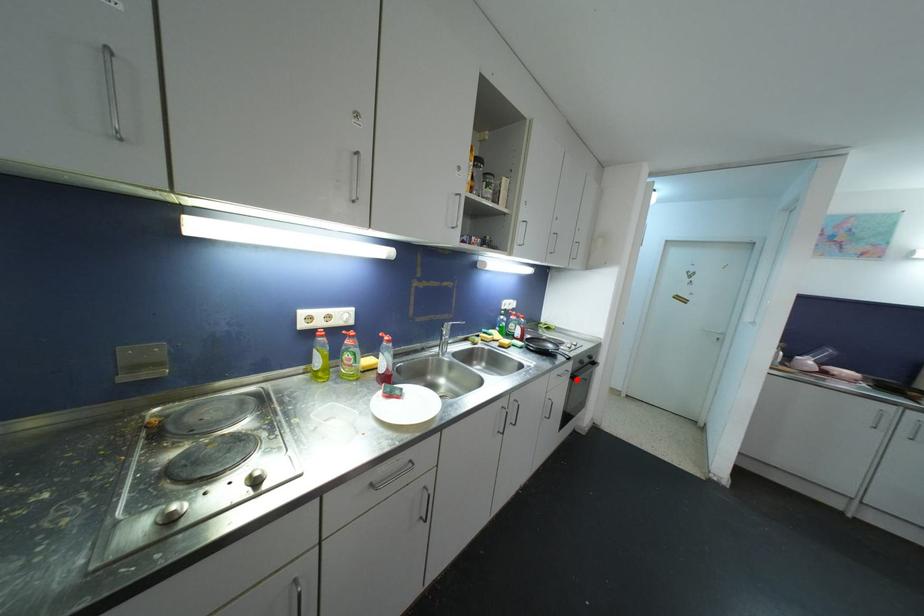
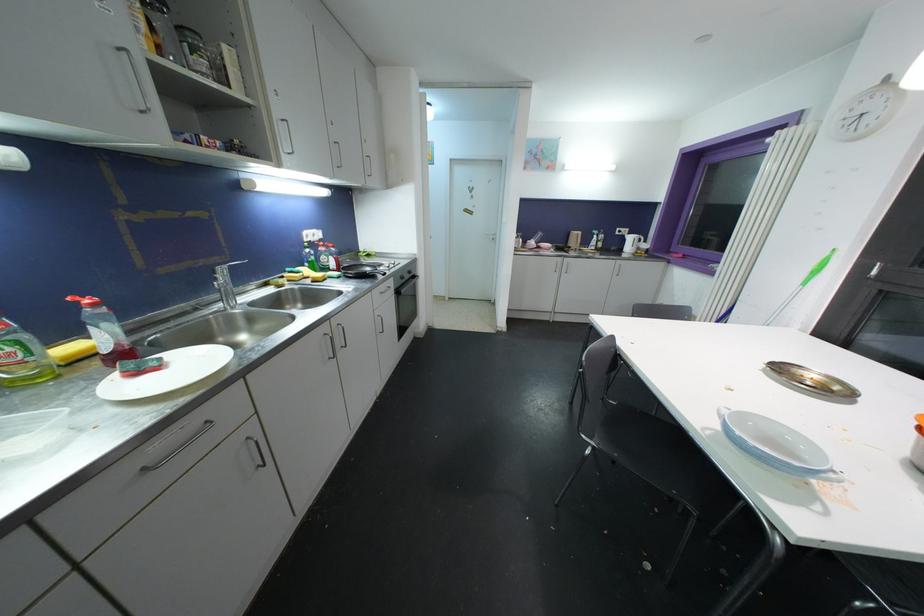
Question: I am providing you with two images of the same scene from different viewpoints. Image1 has a red point marked. In image2, the corresponding 3D location appears at what relative position? Reply with the corresponding letter.

Choices:
 (A) Closer
 (B) Farther

Answer: (A)